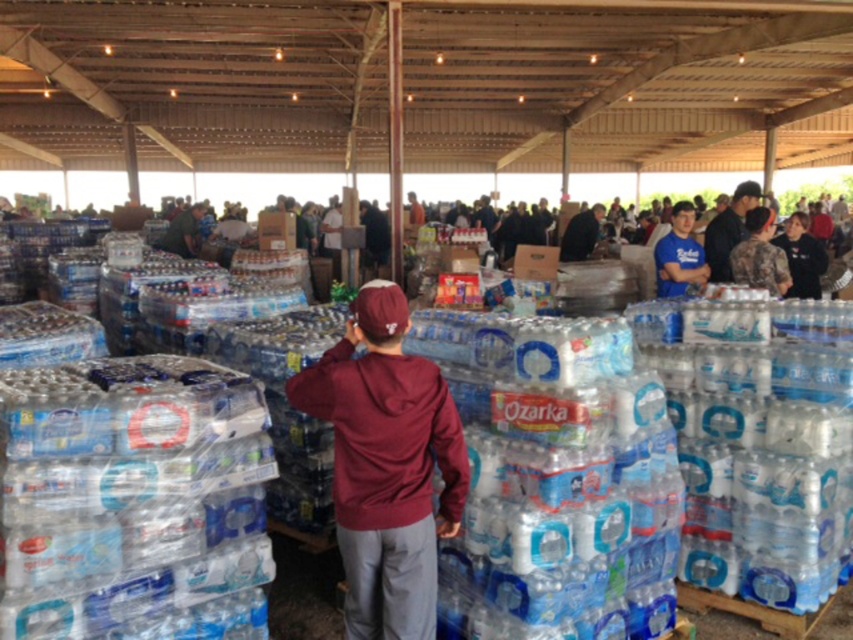
You are standing at the entrance of the warehouse and see the point at coordinates (386, 465). What object is located at that point?

The point at coordinates (386, 465) corresponds to the maroon hoodie at center.

You are a volunteer at the distribution center and need to determine which clothing item is higher in the image. The scene has a man in a maroon hoodie at center and another person in a blue cotton shirt at upper right. Which clothing item is positioned higher?

The blue cotton shirt at upper right is positioned higher in the image than the maroon hoodie at center.

You are a volunteer at the distribution center and need to hand out supplies. You see a camouflage uniform at right and a blue cotton shirt at upper right. Which direction should you move to reach the closer one first?

Both the camouflage uniform at right and blue cotton shirt at upper right are 26.15 inches apart from each other, so they are equally distant. You can choose either direction to reach them first.